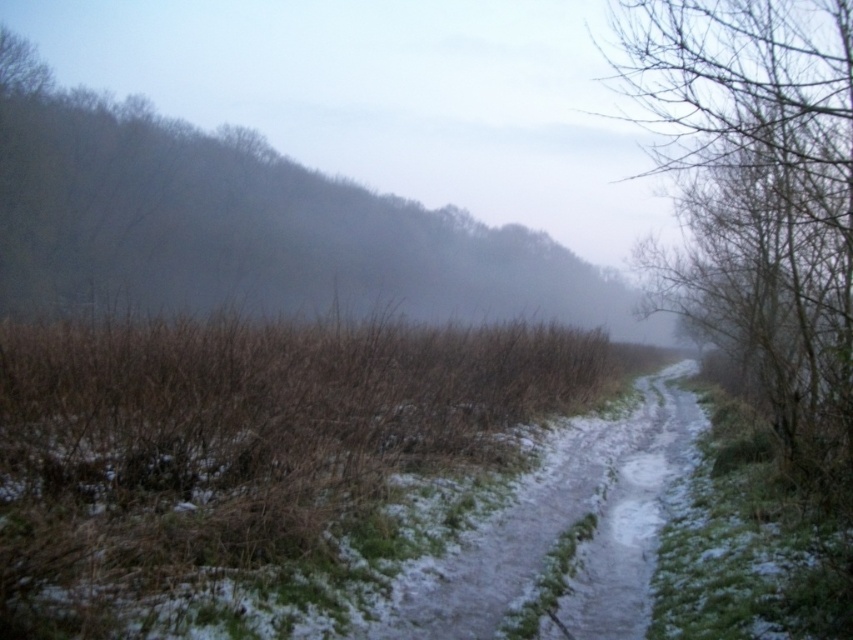
Question: Among these points, which one is farthest from the camera?

Choices:
 (A) (548, 614)
 (B) (821, 346)

Answer: (B)

Question: Is bare branches at right in front of sandy dirt trail at center?

Choices:
 (A) no
 (B) yes

Answer: (B)

Question: Is bare branches at right wider than sandy dirt trail at center?

Choices:
 (A) no
 (B) yes

Answer: (B)

Question: Which of the following is the farthest from the observer?

Choices:
 (A) sandy dirt trail at center
 (B) bare branches at right

Answer: (A)

Question: Does bare branches at right lie in front of sandy dirt trail at center?

Choices:
 (A) yes
 (B) no

Answer: (A)